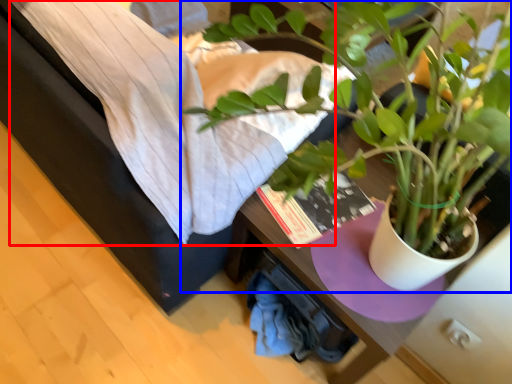
Question: Which object is further to the camera taking this photo, sheet (highlighted by a red box) or houseplant (highlighted by a blue box)?

Choices:
 (A) sheet
 (B) houseplant

Answer: (A)